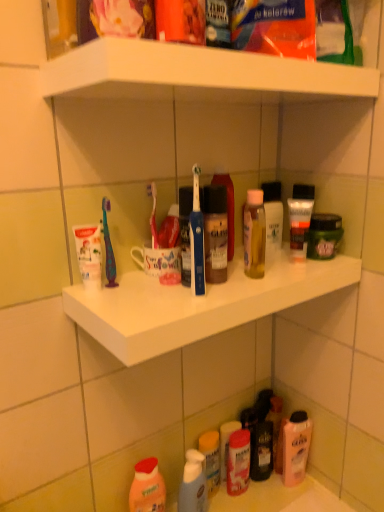
Locate an element on the screen. free space that is in between blue plastic toothbrush at center and white matte toothpaste at left is located at coordinates (146, 294).